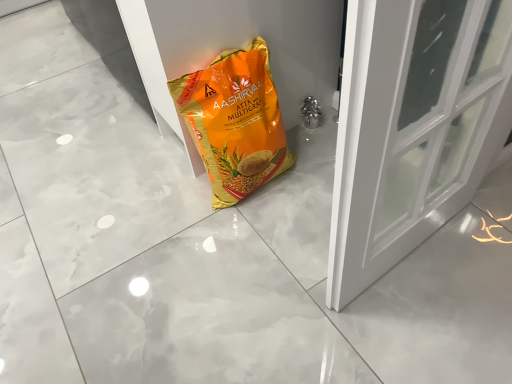
Question: Is orange matte plastic bag at center a part of white glossy door at center?

Choices:
 (A) no
 (B) yes

Answer: (A)

Question: Is white glossy door at center thinner than orange matte plastic bag at center?

Choices:
 (A) yes
 (B) no

Answer: (B)

Question: From a real-world perspective, is white glossy door at center physically below orange matte plastic bag at center?

Choices:
 (A) no
 (B) yes

Answer: (B)

Question: Can you confirm if white glossy door at center is bigger than orange matte plastic bag at center?

Choices:
 (A) no
 (B) yes

Answer: (B)

Question: Is white glossy door at center positioned in front of orange matte plastic bag at center?

Choices:
 (A) yes
 (B) no

Answer: (B)

Question: Is white glossy door at center taller than orange matte plastic bag at center?

Choices:
 (A) no
 (B) yes

Answer: (A)

Question: Is orange matte plastic bag at center further to the viewer compared to white glossy door at center?

Choices:
 (A) no
 (B) yes

Answer: (A)

Question: Is orange matte plastic bag at center smaller than white glossy door at center?

Choices:
 (A) no
 (B) yes

Answer: (B)

Question: Is orange matte plastic bag at center aimed at white glossy door at center?

Choices:
 (A) no
 (B) yes

Answer: (A)

Question: From a real-world perspective, is orange matte plastic bag at center on white glossy door at center?

Choices:
 (A) yes
 (B) no

Answer: (A)

Question: Is orange matte plastic bag at center completely or partially outside of white glossy door at center?

Choices:
 (A) yes
 (B) no

Answer: (A)

Question: From the image's perspective, would you say orange matte plastic bag at center is shown under white glossy door at center?

Choices:
 (A) yes
 (B) no

Answer: (A)

Question: Considering the positions of orange matte plastic bag at center and white glossy door at center in the image, is orange matte plastic bag at center bigger or smaller than white glossy door at center?

Choices:
 (A) small
 (B) big

Answer: (A)